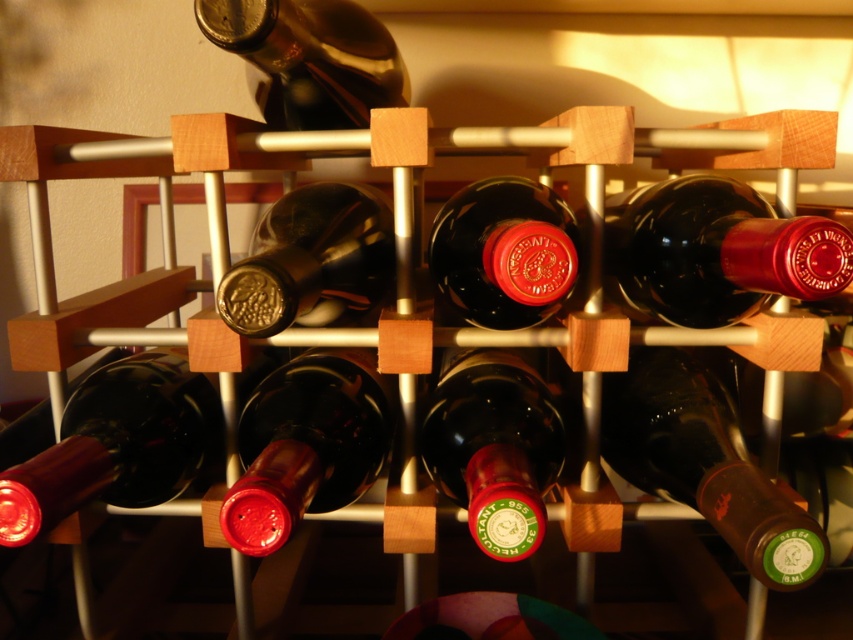
You are a wine collector trying to organize your collection. You have a shelf that can only hold items up to 30 cm in height. You see the shiny dark red bottle at center and the matte red cork at center in the wine rack. Can both items fit on the shelf?

The shiny dark red bottle at center is much taller than the matte red cork at center. Since the shelf has a height limit of 30 cm, we need to know the exact height of the bottle. However, the description only states the bottle is much taller than the cork, but doesn not provide specific measurements. Therefore, it is uncertain if the bottle will fit on the shelf without more information.

Looking at this image, you are trying to locate the shiny dark red bottle at center in a wine rack. According to the coordinates given, where exactly is it positioned?

The shiny dark red bottle at center is positioned at coordinates point (717, 252).

You are organizing a wine tasting event and need to ensure that the shiny dark red bottle at center and the matte red cork at center fit into a display case that has a width limit of 10 cm. Given their sizes, can both items be placed side by side without exceeding the width limit?

The shiny dark red bottle at center is wider than the matte red cork at center. However, without knowing the exact widths of each item, it is impossible to determine if their combined width exceeds 10 cm. Additional measurements are needed to confirm.